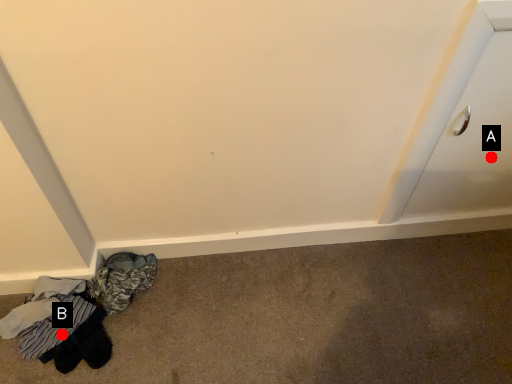
Question: Two points are circled on the image, labeled by A and B beside each circle. Which point is closer to the camera taking this photo?

Choices:
 (A) A is closer
 (B) B is closer

Answer: (B)